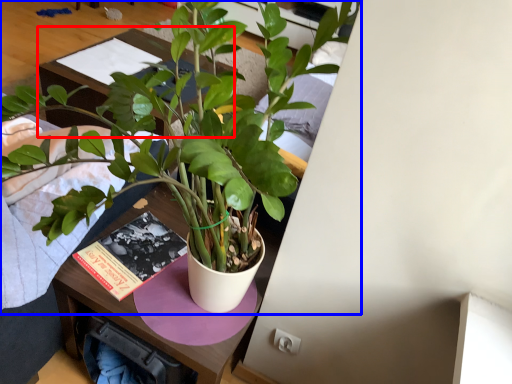
Question: Which object is further to the camera taking this photo, table (highlighted by a red box) or houseplant (highlighted by a blue box)?

Choices:
 (A) table
 (B) houseplant

Answer: (A)